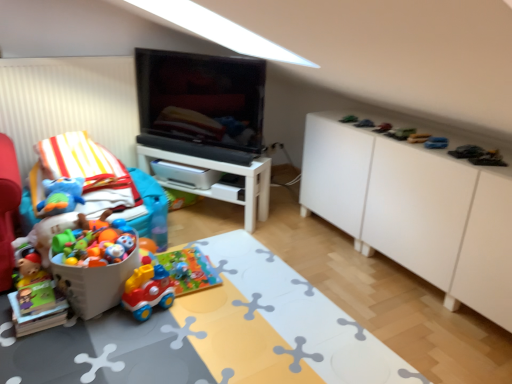
Locate an element on the screen. The image size is (512, 384). vacant area that is in front of white plastic bucket at lower left is located at coordinates [83, 351].